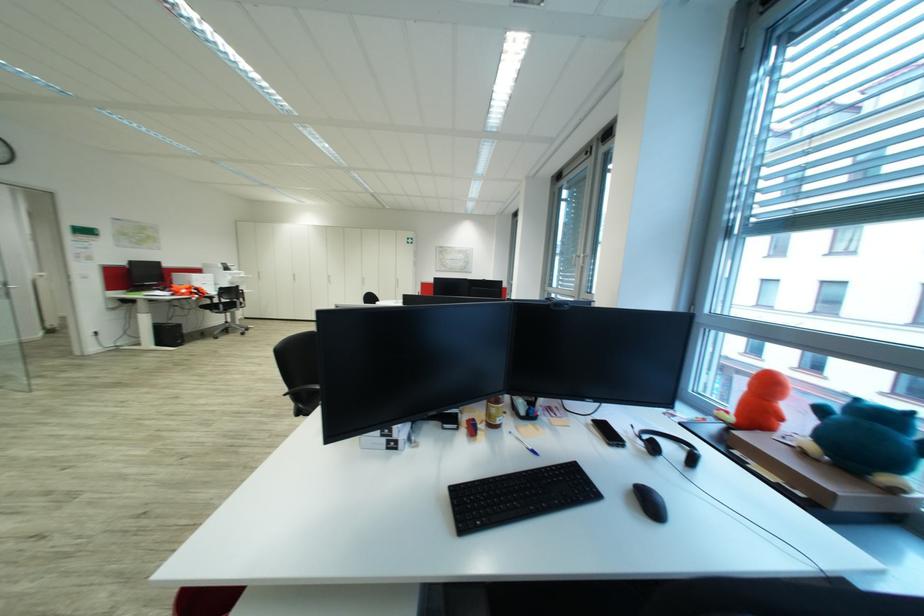
Find where to lift the blue plush toy. Please return your answer as a coordinate pair (x, y).

(867, 442)